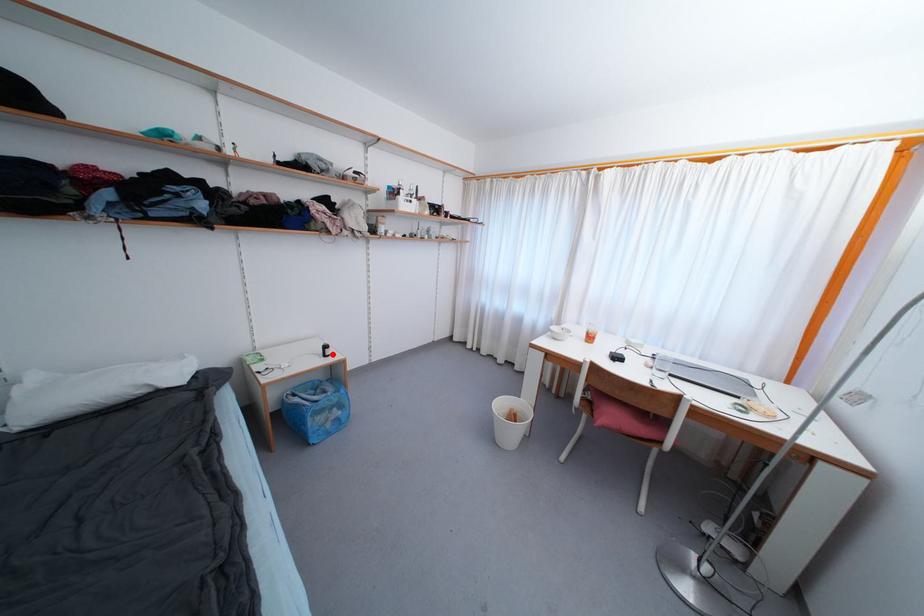
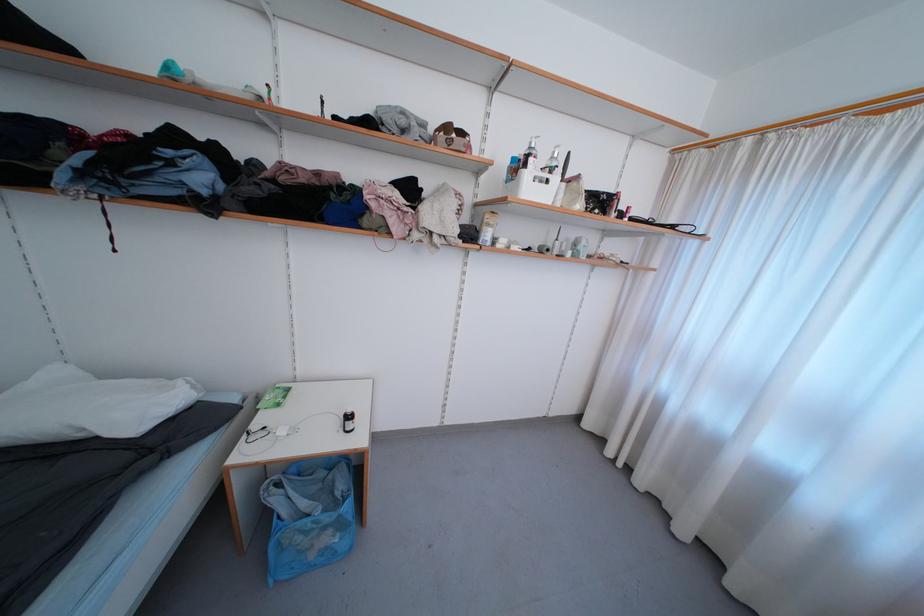
Question: I am providing you with two images of the same scene from different viewpoints. In image1, a red point is highlighted. Considering the same 3D point in image2, which of the following is correct?

Choices:
 (A) It is closer
 (B) It is farther

Answer: (B)